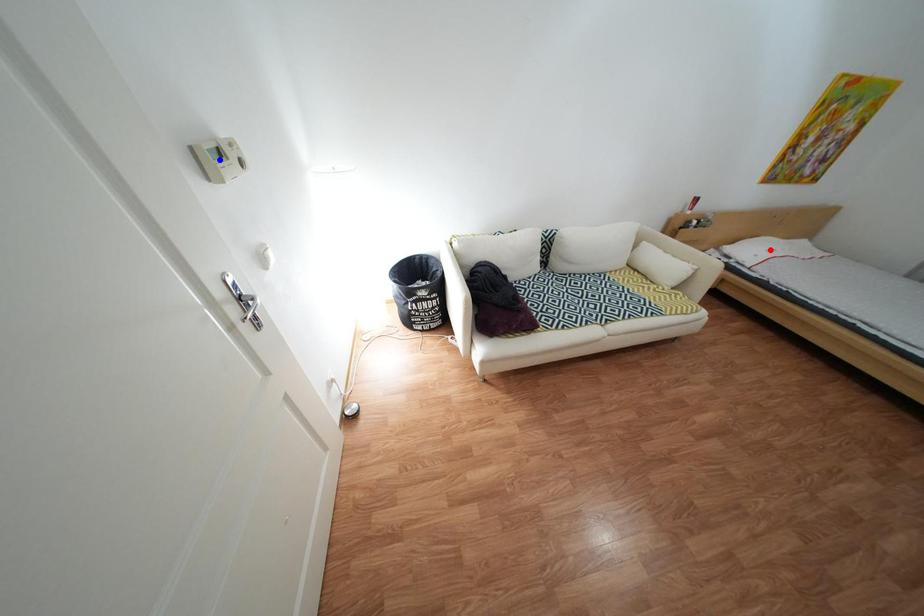
Question: Two points are marked on the image. Which point is closer to the camera?

Choices:
 (A) Blue point is closer.
 (B) Red point is closer.

Answer: (A)